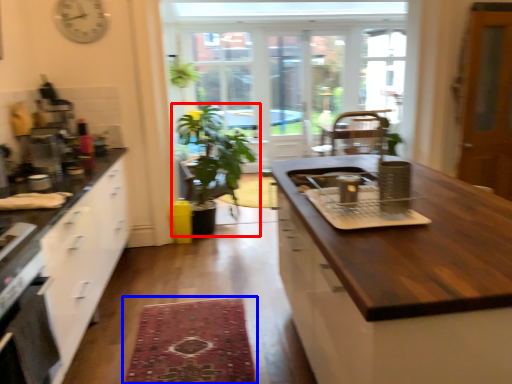
Question: Which object is closer to the camera taking this photo, houseplant (highlighted by a red box) or mat (highlighted by a blue box)?

Choices:
 (A) houseplant
 (B) mat

Answer: (B)